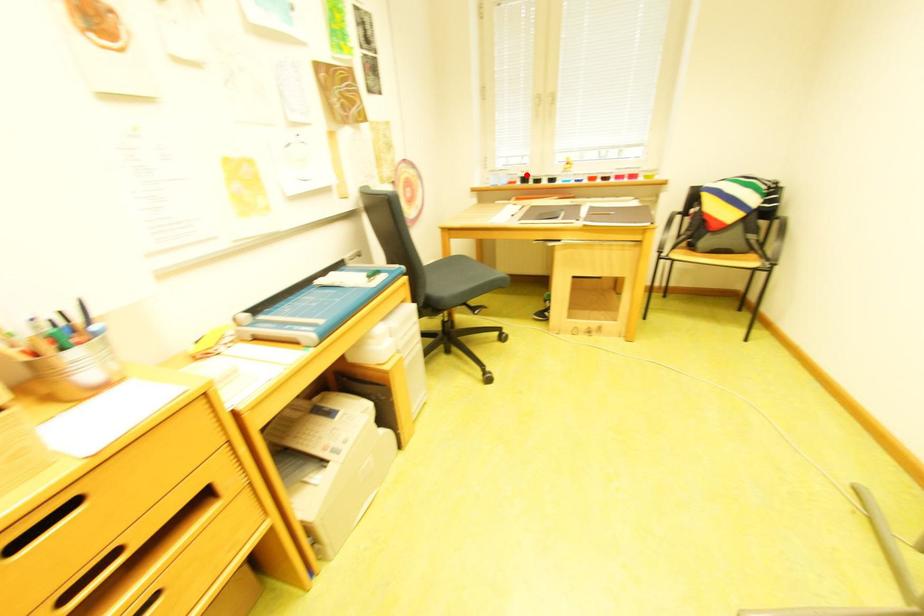
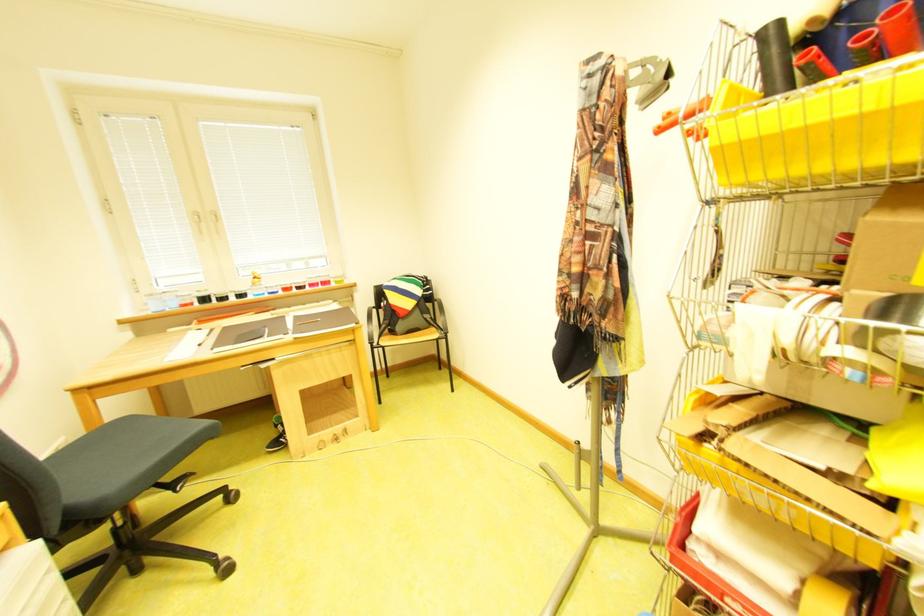
Question: I am providing you with two images of the same scene from different viewpoints. Given a red point in image1, look at the same physical point in image2. Is it:

Choices:
 (A) Closer to the viewpoint
 (B) Farther from the viewpoint

Answer: (B)